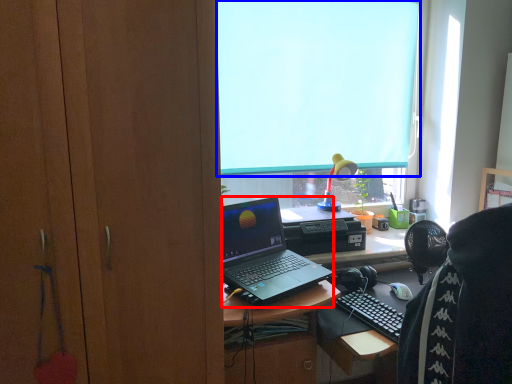
Question: Which object appears farthest to the camera in this image, laptop (highlighted by a red box) or window screen (highlighted by a blue box)?

Choices:
 (A) laptop
 (B) window screen

Answer: (B)